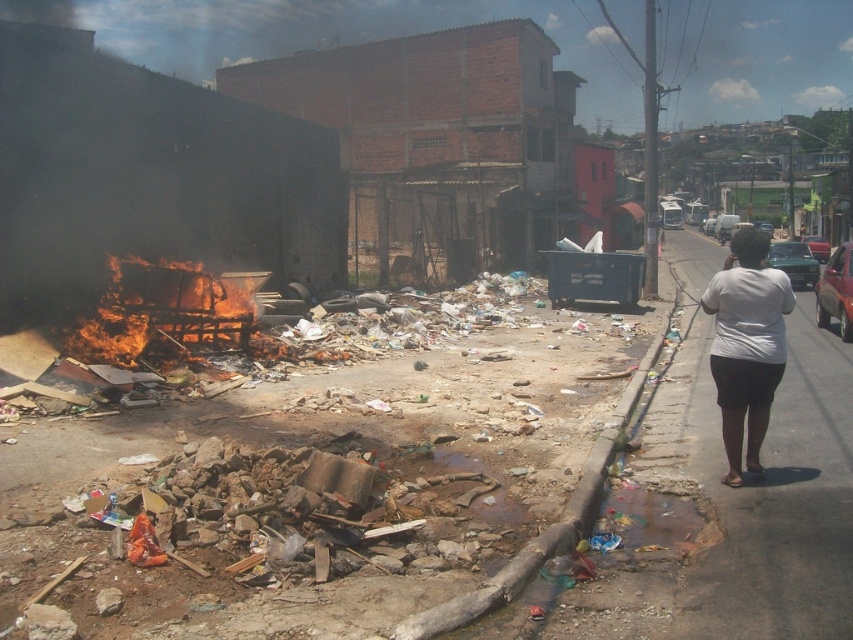
You are a firefighter assessing the scene. You see the flaming wood at left and the brown concrete curb at lower center. Which object is higher in height?

The flaming wood at left is much taller than the brown concrete curb at lower center.

You are a firefighter assessing the scene. You see the flaming wood at left and the brown concrete curb at lower center. Which object is positioned higher relative to the other?

The flaming wood at left is located above the brown concrete curb at lower center, so it is positioned higher.